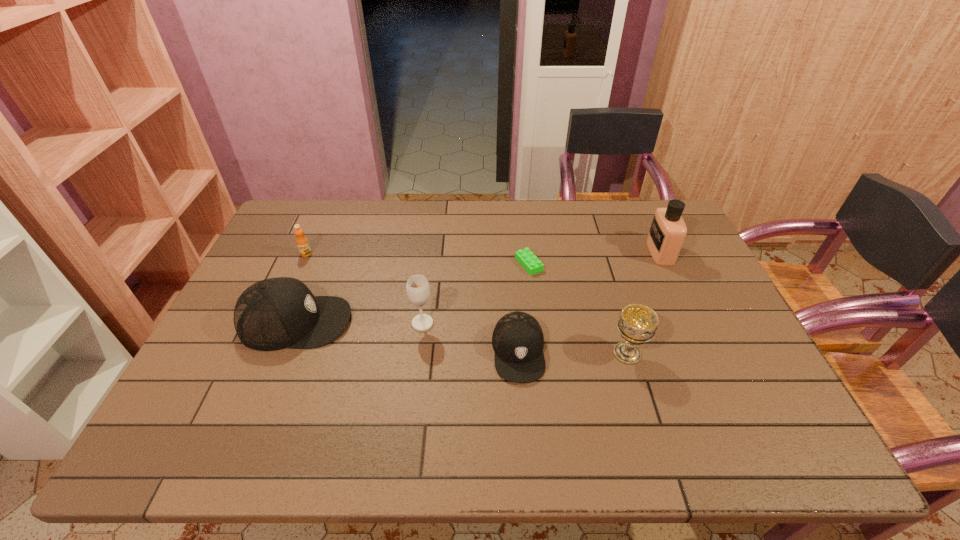
Locate an element on the screen. the left cap is located at coordinates click(x=275, y=313).

Identify the location of the shorter cap. (518, 341).

Image resolution: width=960 pixels, height=540 pixels. Identify the location of the sixth tallest object. (518, 341).

I want to click on perfume, so click(x=668, y=230).

In order to click on orange juice in this screenshot , I will do click(x=302, y=242).

This screenshot has height=540, width=960. I want to click on the shortest object, so click(x=530, y=262).

Locate an element on the screen. The image size is (960, 540). chalice is located at coordinates (638, 323).

Find the location of a particular element. The image size is (960, 540). the third object from left to right is located at coordinates (x=418, y=289).

At what (x,y) coordinates should I click in order to perform the action: click on free point located on the front-facing side of the taller cap. Please return your answer as a coordinate pair (x, y). Looking at the image, I should click on (439, 322).

The width and height of the screenshot is (960, 540). I want to click on free space located 0.060m on the front-facing side of the right cap, so click(x=522, y=407).